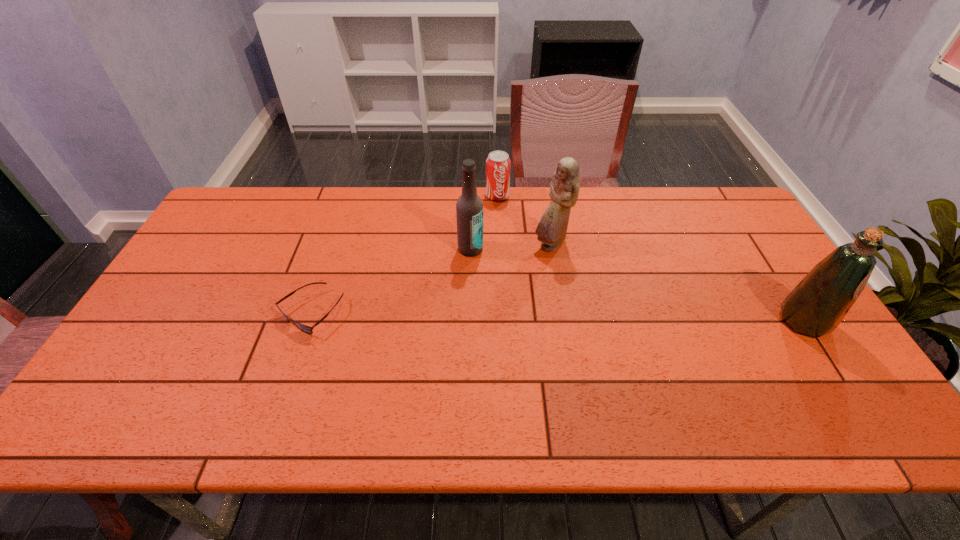
Locate an element on the screen. sunglasses is located at coordinates (307, 329).

Find the location of a particular element. Image resolution: width=960 pixels, height=540 pixels. the shortest object is located at coordinates (307, 329).

The height and width of the screenshot is (540, 960). I want to click on the rightmost object, so click(816, 306).

Identify the location of figurine. point(564,188).

Locate an element on the screen. soda can is located at coordinates (498, 164).

The width and height of the screenshot is (960, 540). Identify the location of the third object from right to left. coord(498,164).

At what (x,y) coordinates should I click in order to perform the action: click on beer bottle. Please return your answer as a coordinate pair (x, y). Looking at the image, I should click on (469, 208).

Where is `vacant point located 0.130m at the front of the leftmost object showing the lenses`? Image resolution: width=960 pixels, height=540 pixels. vacant point located 0.130m at the front of the leftmost object showing the lenses is located at coordinates pyautogui.click(x=287, y=383).

Locate an element on the screen. This screenshot has height=540, width=960. vacant region located 0.150m on the front-facing side of the figurine is located at coordinates (540, 293).

Image resolution: width=960 pixels, height=540 pixels. Identify the location of vacant space situated 0.310m on the front-facing side of the figurine. (532, 339).